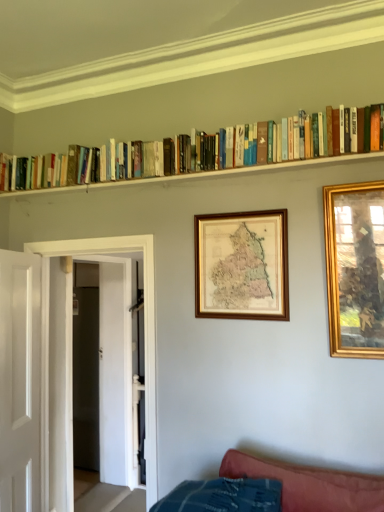
Locate an element on the screen. The image size is (384, 512). gold-framed picture at right, arranged as the first picture frame when viewed from the front is located at coordinates (355, 268).

The width and height of the screenshot is (384, 512). I want to click on white glossy door at left, the first door from the back, so [x=56, y=390].

The height and width of the screenshot is (512, 384). What are the coordinates of `wooden books at upper center` in the screenshot? It's located at (206, 174).

Locate an element on the screen. The image size is (384, 512). hardcover books at upper center is located at coordinates (197, 152).

Where is `gold-framed picture at right, arranged as the first picture frame when viewed from the front`? This screenshot has width=384, height=512. gold-framed picture at right, arranged as the first picture frame when viewed from the front is located at coordinates (355, 268).

Is point (185, 153) positioned after point (353, 282)?

Yes.

Can you confirm if hardcover books at upper center is taller than gold-framed picture at right, positioned as the second picture frame in back-to-front order?

No.

Looking at their sizes, would you say hardcover books at upper center is wider or thinner than gold-framed picture at right, positioned as the second picture frame in back-to-front order?

hardcover books at upper center is wider than gold-framed picture at right, positioned as the second picture frame in back-to-front order.

Can you confirm if white smooth door at left, acting as the 2th door starting from the back, is thinner than gold-framed picture at right, the 1th picture frame positioned from the right?

No, white smooth door at left, acting as the 2th door starting from the back, is not thinner than gold-framed picture at right, the 1th picture frame positioned from the right.

Is white smooth door at left, acting as the 2th door starting from the back, aimed at gold-framed picture at right, arranged as the 2th picture frame when viewed from the left?

Yes, white smooth door at left, acting as the 2th door starting from the back, is oriented towards gold-framed picture at right, arranged as the 2th picture frame when viewed from the left.

Visually, is white smooth door at left, the 1th door positioned from the front, positioned to the left or to the right of gold-framed picture at right, arranged as the first picture frame when viewed from the front?

white smooth door at left, the 1th door positioned from the front, is to the left of gold-framed picture at right, arranged as the first picture frame when viewed from the front.

Is white smooth door at left, acting as the 2th door starting from the back, far from gold-framed picture at right, positioned as the second picture frame in back-to-front order?

Answer: That's right, there is a large distance between white smooth door at left, acting as the 2th door starting from the back, and gold-framed picture at right, positioned as the second picture frame in back-to-front order.

Is wooden books at upper center positioned beyond the bounds of white glossy door at left, the 2th door from the front?

Yes, wooden books at upper center is not within white glossy door at left, the 2th door from the front.

Is wooden books at upper center positioned before white glossy door at left, the first door from the back?

Yes, the depth of wooden books at upper center is less than that of white glossy door at left, the first door from the back.

From a real-world perspective, who is located lower, wooden books at upper center or white glossy door at left, the 2th door from the front?

white glossy door at left, the 2th door from the front, is physically lower.

Is there a large distance between wooden books at upper center and white glossy door at left, the first door from the back?

wooden books at upper center is positioned a significant distance from white glossy door at left, the first door from the back.

From the image's perspective, between wooden framed map at center, the second picture frame from the front, and gold-framed picture at right, the 1th picture frame positioned from the right, who is located below?

gold-framed picture at right, the 1th picture frame positioned from the right, from the image's perspective.

The height and width of the screenshot is (512, 384). I want to click on picture frame above the gold-framed picture at right, arranged as the 2th picture frame when viewed from the left (from the image's perspective), so click(242, 265).

In terms of height, does wooden framed map at center, the first picture frame from the back, look taller or shorter compared to gold-framed picture at right, arranged as the first picture frame when viewed from the front?

wooden framed map at center, the first picture frame from the back, is shorter than gold-framed picture at right, arranged as the first picture frame when viewed from the front.

Considering the relative positions of white glossy door at left, the first door from the back, and gold-framed picture at right, arranged as the first picture frame when viewed from the front, in the image provided, is white glossy door at left, the first door from the back, to the left or to the right of gold-framed picture at right, arranged as the first picture frame when viewed from the front,?

In the image, white glossy door at left, the first door from the back, appears on the left side of gold-framed picture at right, arranged as the first picture frame when viewed from the front.

Based on the photo, how different are the orientations of white glossy door at left, the first door from the back, and gold-framed picture at right, arranged as the 2th picture frame when viewed from the left, in degrees?

The facing directions of white glossy door at left, the first door from the back, and gold-framed picture at right, arranged as the 2th picture frame when viewed from the left, are 88.3 degrees apart.

Is point (128, 469) behind point (362, 197)?

Yes, point (128, 469) is behind point (362, 197).

Which is correct: white glossy door at left, the 2th door from the front, is inside gold-framed picture at right, positioned as the second picture frame in back-to-front order, or outside of it?

white glossy door at left, the 2th door from the front, cannot be found inside gold-framed picture at right, positioned as the second picture frame in back-to-front order.

Where is `door located in front of the wooden framed map at center, the first picture frame from the back`? The image size is (384, 512). door located in front of the wooden framed map at center, the first picture frame from the back is located at coordinates (20, 381).

Is white smooth door at left, the 1th door positioned from the front, inside wooden framed map at center, the 2th picture frame in the right-to-left sequence?

Definitely not — white smooth door at left, the 1th door positioned from the front, is not inside wooden framed map at center, the 2th picture frame in the right-to-left sequence.

Which of these two, wooden framed map at center, the first picture frame from the back, or white smooth door at left, the 1th door positioned from the front, is thinner?

wooden framed map at center, the first picture frame from the back, is thinner.

Is wooden framed map at center, the 2th picture frame in the right-to-left sequence, far away from white smooth door at left, acting as the 2th door starting from the back?

wooden framed map at center, the 2th picture frame in the right-to-left sequence, is positioned a significant distance from white smooth door at left, acting as the 2th door starting from the back.

Is white glossy door at left, the 2th door from the front, touching wooden books at upper center?

No, white glossy door at left, the 2th door from the front, is not touching wooden books at upper center.

Does white glossy door at left, the first door from the back, turn towards wooden books at upper center?

No, white glossy door at left, the first door from the back, is not aimed at wooden books at upper center.

Which is more to the left, white glossy door at left, the first door from the back, or wooden books at upper center?

white glossy door at left, the first door from the back, is more to the left.

Does white glossy door at left, the first door from the back, lie behind wooden books at upper center?

Yes.

Image resolution: width=384 pixels, height=512 pixels. In order to click on book above the gold-framed picture at right, positioned as the second picture frame in back-to-front order (from the image's perspective) in this screenshot , I will do `click(197, 152)`.

I want to click on the 1st door below the gold-framed picture at right, arranged as the 2th picture frame when viewed from the left (from the image's perspective), so (20, 381).

Estimate the real-world distances between objects in this image. Which object is further from gold-framed picture at right, positioned as the second picture frame in back-to-front order, wooden books at upper center or wooden framed map at center, the 1th picture frame in the left-to-right sequence?

The object further to gold-framed picture at right, positioned as the second picture frame in back-to-front order, is wooden books at upper center.

Considering their positions, is gold-framed picture at right, positioned as the second picture frame in back-to-front order, positioned further to wooden books at upper center than white glossy door at left, the 2th door from the front?

white glossy door at left, the 2th door from the front, lies further to wooden books at upper center than the other object.

From the picture: Estimate the real-world distances between objects in this image. Which object is further from white glossy door at left, the first door from the back, white smooth door at left, the 1th door positioned from the front, or wooden framed map at center, the second picture frame from the front?

Based on the image, wooden framed map at center, the second picture frame from the front, appears to be further to white glossy door at left, the first door from the back.

Which object lies further to the anchor point wooden books at upper center, wooden framed map at center, the first picture frame from the back, or white glossy door at left, the 2th door from the front?

Based on the image, white glossy door at left, the 2th door from the front, appears to be further to wooden books at upper center.

Looking at the image, which one is located closer to gold-framed picture at right, arranged as the first picture frame when viewed from the front, white smooth door at left, acting as the 2th door starting from the back, or wooden books at upper center?

wooden books at upper center.

Considering their positions, is wooden books at upper center positioned closer to white smooth door at left, the 1th door positioned from the front, than white glossy door at left, the 2th door from the front?

Based on the image, white glossy door at left, the 2th door from the front, appears to be nearer to white smooth door at left, the 1th door positioned from the front.

Which object lies further to the anchor point hardcover books at upper center, wooden framed map at center, the 2th picture frame in the right-to-left sequence, or white smooth door at left, the 1th door positioned from the front?

Among the two, white smooth door at left, the 1th door positioned from the front, is located further to hardcover books at upper center.

Considering their positions, is wooden framed map at center, the 1th picture frame in the left-to-right sequence, positioned closer to gold-framed picture at right, the 1th picture frame positioned from the right, than white glossy door at left, the first door from the back?

wooden framed map at center, the 1th picture frame in the left-to-right sequence, lies closer to gold-framed picture at right, the 1th picture frame positioned from the right, than the other object.

Identify the location of book between white smooth door at left, the 1th door positioned from the front, and gold-framed picture at right, the 1th picture frame positioned from the right, in the horizontal direction. The width and height of the screenshot is (384, 512). (197, 152).

Locate an element on the screen. The image size is (384, 512). shelf between hardcover books at upper center and wooden framed map at center, the 1th picture frame in the left-to-right sequence, vertically is located at coordinates (206, 174).

Identify the location of picture frame between white smooth door at left, acting as the 2th door starting from the back, and gold-framed picture at right, arranged as the first picture frame when viewed from the front. The image size is (384, 512). (242, 265).

Image resolution: width=384 pixels, height=512 pixels. Identify the location of book situated between white glossy door at left, the 2th door from the front, and gold-framed picture at right, arranged as the first picture frame when viewed from the front, from left to right. (197, 152).